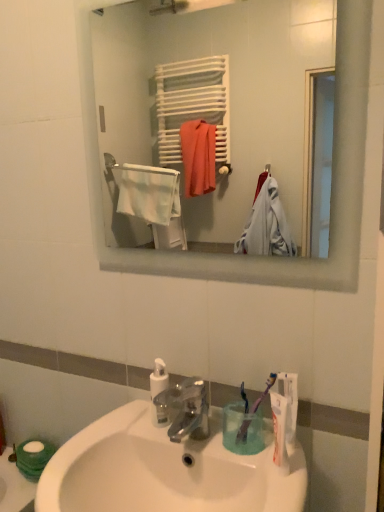
At what (x,y) coordinates should I click in order to perform the action: click on free space to the left of white matte toothpaste at lower right. Please return your answer as a coordinate pair (x, y). Looking at the image, I should click on (227, 440).